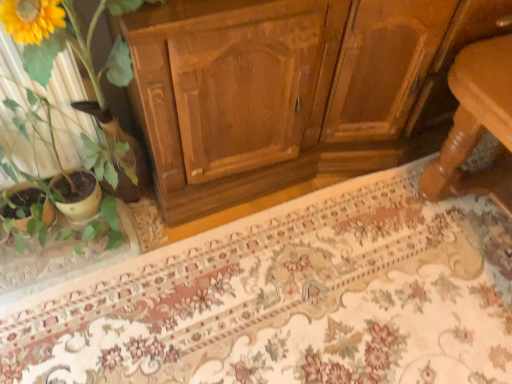
Locate an element on the screen. vacant space situated above floral carpet at center (from a real-world perspective) is located at coordinates pyautogui.click(x=282, y=269).